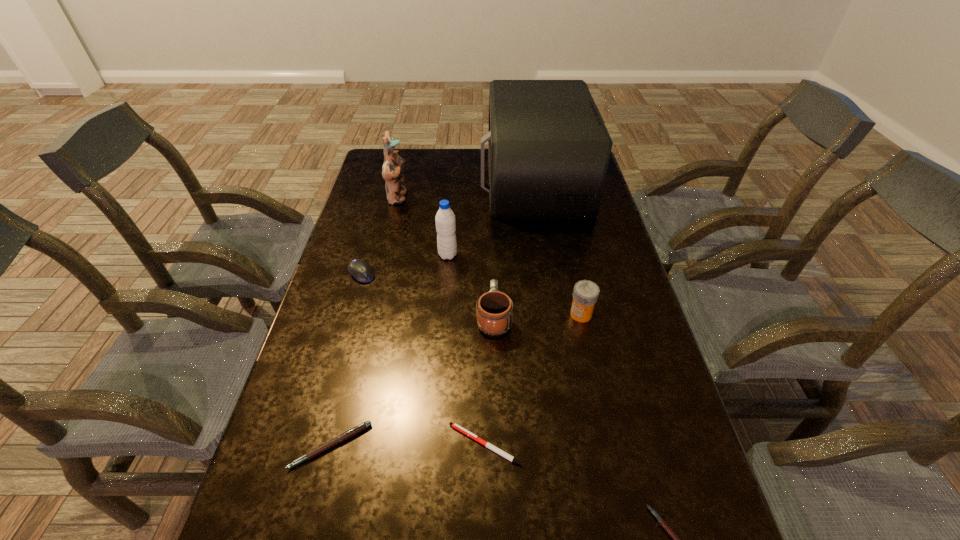
Locate an element on the screen. This screenshot has height=540, width=960. microwave oven is located at coordinates (549, 149).

You are a GUI agent. You are given a task and a screenshot of the screen. Output one action in this format:
    pyautogui.click(x=<x>, y=<y>)
    Task: Click on the figurine
    This screenshot has width=960, height=540.
    Given the screenshot: What is the action you would take?
    pyautogui.click(x=392, y=171)

Find the location of `the second tallest object`. the second tallest object is located at coordinates (392, 171).

This screenshot has height=540, width=960. Find the location of `the third farthest object`. the third farthest object is located at coordinates pos(445,220).

Find the location of a particular element. The width and height of the screenshot is (960, 540). the third tallest object is located at coordinates (445, 220).

Find the location of `orange medicine`. orange medicine is located at coordinates pos(585,294).

At what (x,y) coordinates should I click in order to perform the action: click on mug. Please return your answer as a coordinate pair (x, y). Looking at the image, I should click on (494, 310).

Find the location of a particular element. the fourth farthest object is located at coordinates (360, 269).

This screenshot has width=960, height=540. I want to click on computer mouse, so click(x=360, y=269).

The width and height of the screenshot is (960, 540). What are the coordinates of `the left pink pen` in the screenshot? It's located at (350, 433).